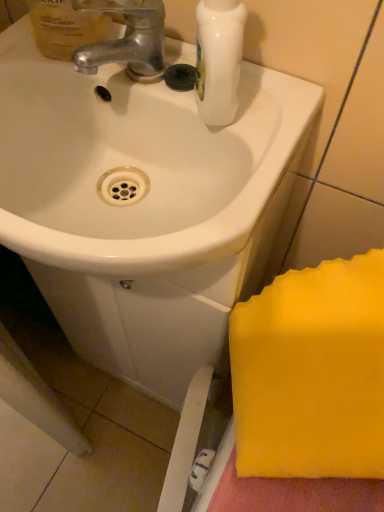
Question: Is white glossy sink at center in front of silver metallic faucet at upper left?

Choices:
 (A) yes
 (B) no

Answer: (A)

Question: From a real-world perspective, is white glossy sink at center positioned under silver metallic faucet at upper left based on gravity?

Choices:
 (A) no
 (B) yes

Answer: (B)

Question: Is white glossy sink at center oriented away from silver metallic faucet at upper left?

Choices:
 (A) no
 (B) yes

Answer: (A)

Question: Does white glossy sink at center appear on the left side of silver metallic faucet at upper left?

Choices:
 (A) yes
 (B) no

Answer: (A)

Question: Can you confirm if white glossy sink at center is shorter than silver metallic faucet at upper left?

Choices:
 (A) no
 (B) yes

Answer: (A)

Question: Is white glossy sink at center aimed at silver metallic faucet at upper left?

Choices:
 (A) yes
 (B) no

Answer: (B)

Question: Considering the relative positions of translucent plastic mouthwash at upper left and silver metallic faucet at upper left in the image provided, is translucent plastic mouthwash at upper left behind silver metallic faucet at upper left?

Choices:
 (A) yes
 (B) no

Answer: (B)

Question: From a real-world perspective, is translucent plastic mouthwash at upper left physically below silver metallic faucet at upper left?

Choices:
 (A) yes
 (B) no

Answer: (B)

Question: Does translucent plastic mouthwash at upper left have a lesser width compared to silver metallic faucet at upper left?

Choices:
 (A) no
 (B) yes

Answer: (B)

Question: Considering the relative positions of translucent plastic mouthwash at upper left and silver metallic faucet at upper left in the image provided, is translucent plastic mouthwash at upper left in front of silver metallic faucet at upper left?

Choices:
 (A) no
 (B) yes

Answer: (B)

Question: Can you confirm if translucent plastic mouthwash at upper left is taller than silver metallic faucet at upper left?

Choices:
 (A) yes
 (B) no

Answer: (A)

Question: Is translucent plastic mouthwash at upper left located outside silver metallic faucet at upper left?

Choices:
 (A) yes
 (B) no

Answer: (A)

Question: Considering the relative sizes of white glossy sink at center and translucent plastic mouthwash at upper left in the image provided, is white glossy sink at center taller than translucent plastic mouthwash at upper left?

Choices:
 (A) yes
 (B) no

Answer: (B)